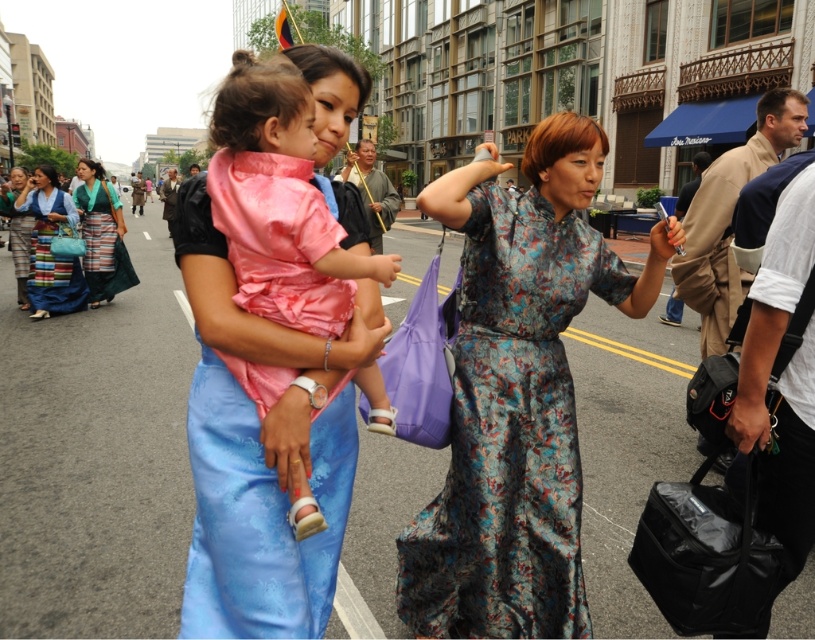
Who is taller, floral silk dress at center or silky pink dress at center?

floral silk dress at center is taller.

This screenshot has height=640, width=815. Describe the element at coordinates (510, 433) in the screenshot. I see `floral silk dress at center` at that location.

Find the location of `floral silk dress at center`. floral silk dress at center is located at coordinates 510,433.

Is floral silk dress at center taller than silky blue dress at lower left?

No.

Is point (526, 436) more distant than point (21, 273)?

No, it is not.

Is point (438, 538) behind point (27, 212)?

No, it is not.

Where is `floral silk dress at center`? The width and height of the screenshot is (815, 640). floral silk dress at center is located at coordinates (510, 433).

Describe the element at coordinates (258, 513) in the screenshot. I see `silky pink dress at center` at that location.

Which is behind, point (285, 589) or point (25, 284)?

The point (25, 284) is more distant.

Locate an element on the screen. silky pink dress at center is located at coordinates (258, 513).

You are a GUI agent. You are given a task and a screenshot of the screen. Output one action in this format:
    pyautogui.click(x=<x>, y=<y>)
    Task: Click on the silky pink dress at center
    This screenshot has width=815, height=640.
    Given the screenshot: What is the action you would take?
    pyautogui.click(x=258, y=513)